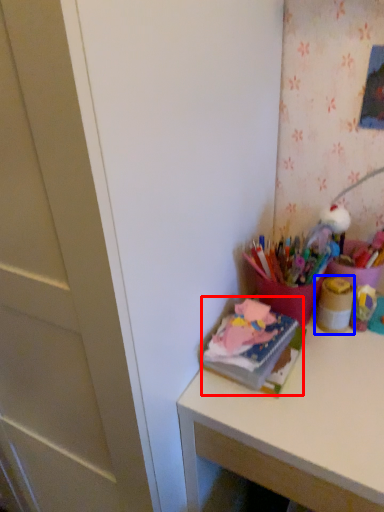
Question: Among these objects, which one is farthest to the camera, book (highlighted by a red box) or stationery (highlighted by a blue box)?

Choices:
 (A) book
 (B) stationery

Answer: (B)